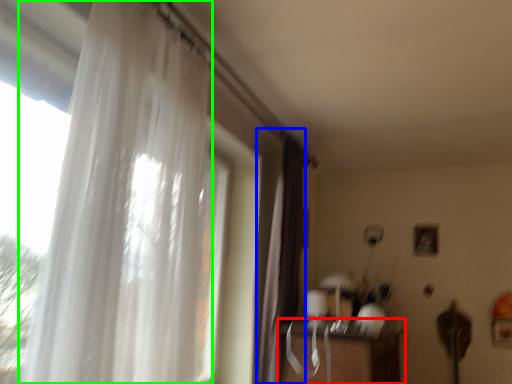
Question: Based on their relative distances, which object is nearer to table (highlighted by a red box)? Choose from curtain (highlighted by a blue box) and curtain (highlighted by a green box).

Choices:
 (A) curtain
 (B) curtain

Answer: (A)